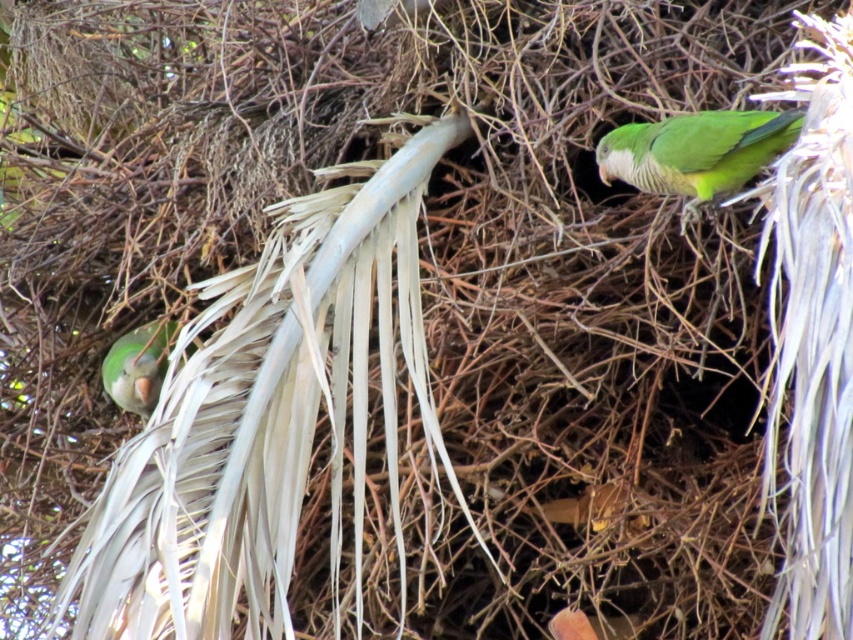
You are a birdwatcher trying to locate two specific points in the image of the parrots. The first point is at coordinate point [723,138] and the second is at point [126,410]. Which point is closer to the observer?

Point [723,138] is in front of point [126,410], so it is closer to the observer.

You are a birdwatcher observing two parrots in a nest. You notice the green matte parrot at upper right and the matte green parrot at left. Which parrot is positioned closer to your viewpoint?

The green matte parrot at upper right is closer to the viewer than the matte green parrot at left.

You are a birdwatcher observing the two parrots in the nest. You notice one parrot is at point (695,152). Which parrot is located at the upper right position?

The green matte parrot at upper right is located at point (695,152).